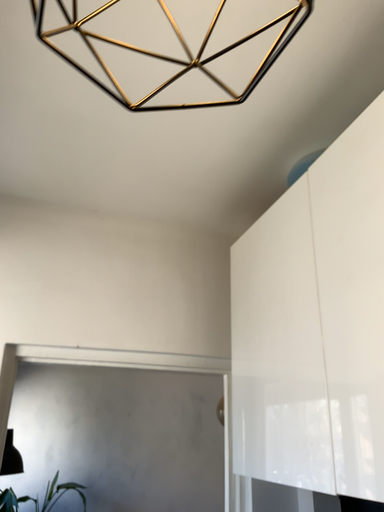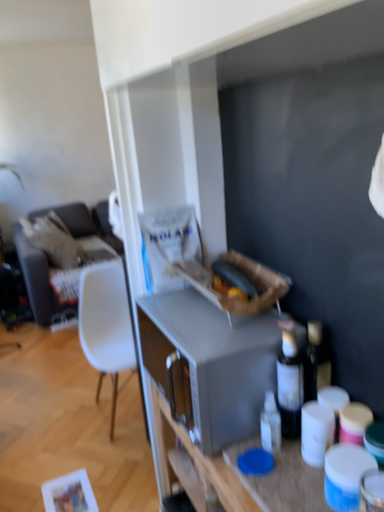
Question: Which way did the camera rotate in the video?

Choices:
 (A) rotated downward
 (B) rotated upward

Answer: (A)